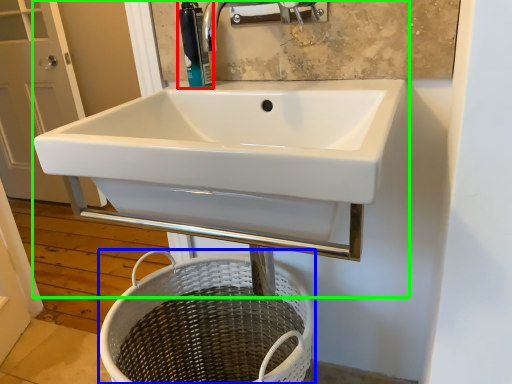
Question: Estimate the real-world distances between objects in this image. Which object is closer to soap dispenser (highlighted by a red box), basket (highlighted by a blue box) or sink (highlighted by a green box)?

Choices:
 (A) basket
 (B) sink

Answer: (B)